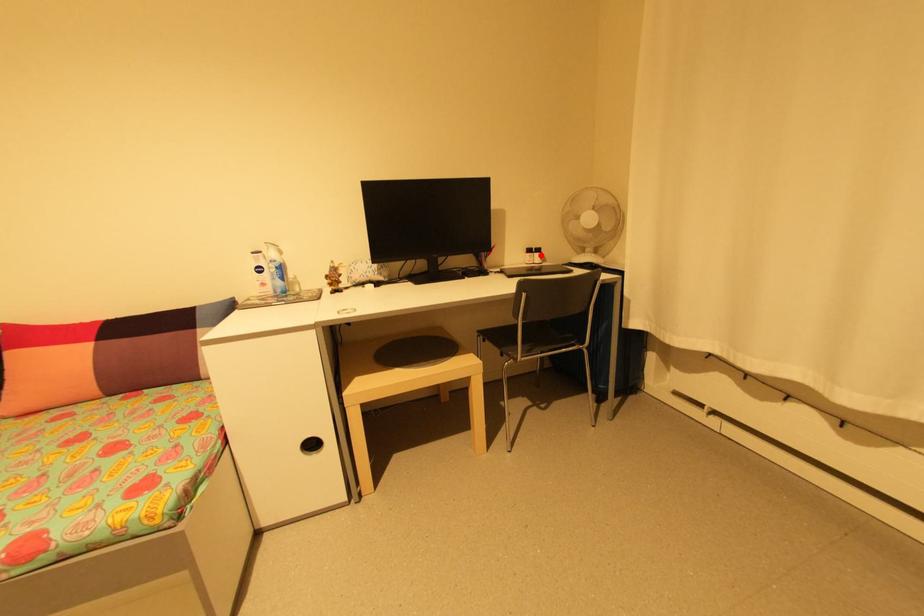
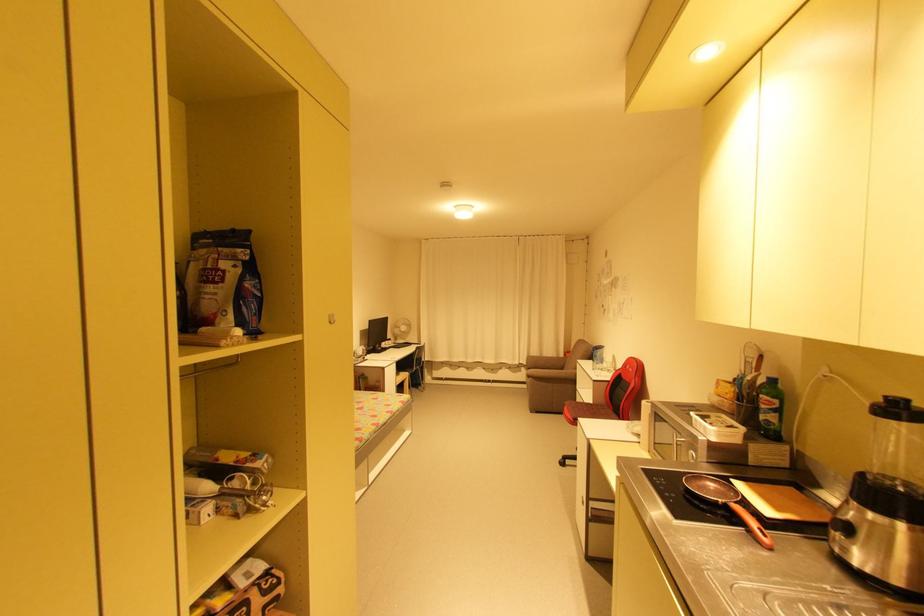
Locate, in the second image, the point that corresponds to the highlighted location in the first image.

(395, 342)